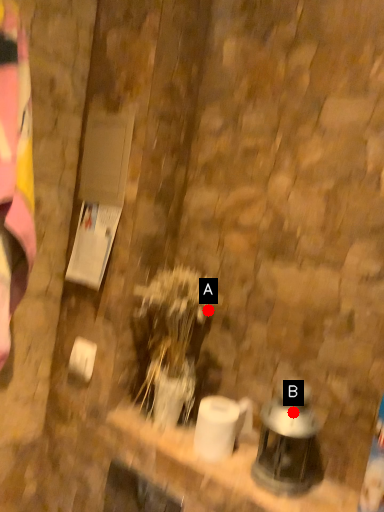
Question: Two points are circled on the image, labeled by A and B beside each circle. Among these points, which one is farthest from the camera?

Choices:
 (A) A is further
 (B) B is further

Answer: (A)